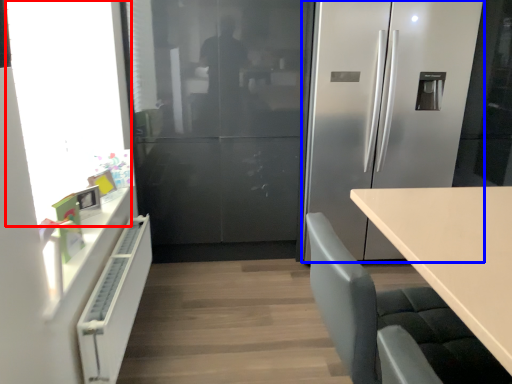
Question: Which object appears farthest to the camera in this image, window screen (highlighted by a red box) or refrigerator (highlighted by a blue box)?

Choices:
 (A) window screen
 (B) refrigerator

Answer: (B)